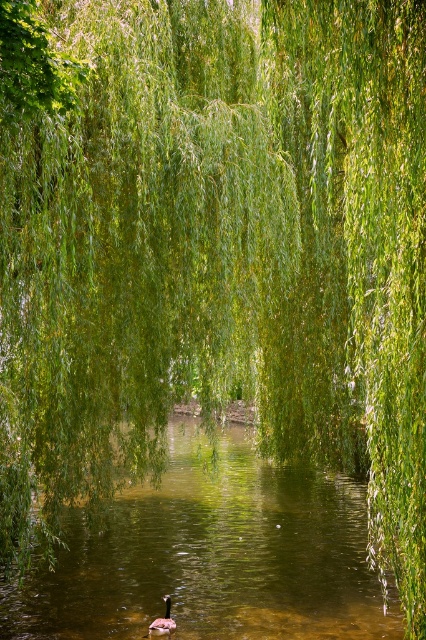
Describe the element at coordinates (354, 259) in the screenshot. I see `green leafy willow at center` at that location.

Is point (414, 440) farther from viewer compared to point (152, 621)?

That is False.

This screenshot has height=640, width=426. In order to click on green leafy willow at center in this screenshot , I will do `click(354, 259)`.

In the scene shown: Can you confirm if green leafy river at center is shorter than brown fuzzy duck at center?

No.

Which is in front, point (129, 512) or point (172, 627)?

Point (172, 627) is in front.

The width and height of the screenshot is (426, 640). Identify the location of green leafy river at center. (213, 556).

Locate an element on the screen. green leafy willow at center is located at coordinates (354, 259).

Describe the element at coordinates (354, 259) in the screenshot. I see `green leafy willow at center` at that location.

Describe the element at coordinates (354, 259) in the screenshot. The height and width of the screenshot is (640, 426). I see `green leafy willow at center` at that location.

Where is `green leafy willow at center`? green leafy willow at center is located at coordinates (354, 259).